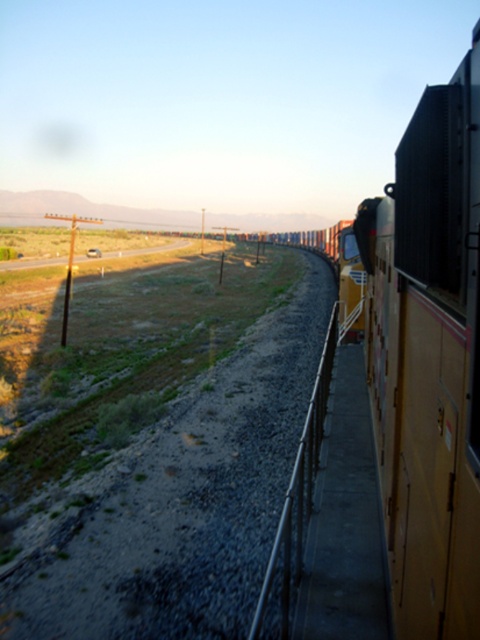
You are standing at the point marked as point (429,358) on the image. What object is exactly at this point?

The metallic brown train car at right is exactly at point (429,358).

You are standing on the train platform and want to board the metallic brown train car at right. If the platform railing is 1.5 meters away from the train tracks, can you safely reach the train car from the platform without stepping onto the tracks?

The metallic brown train car at right and camera are 5.06 feet apart. Since 5.06 feet is approximately 1.54 meters, and the platform railing is only 1.5 meters away from the tracks, the distance between you and the train car is slightly more than the platform railing distance. Therefore, you would need to step onto the tracks to reach it safely.